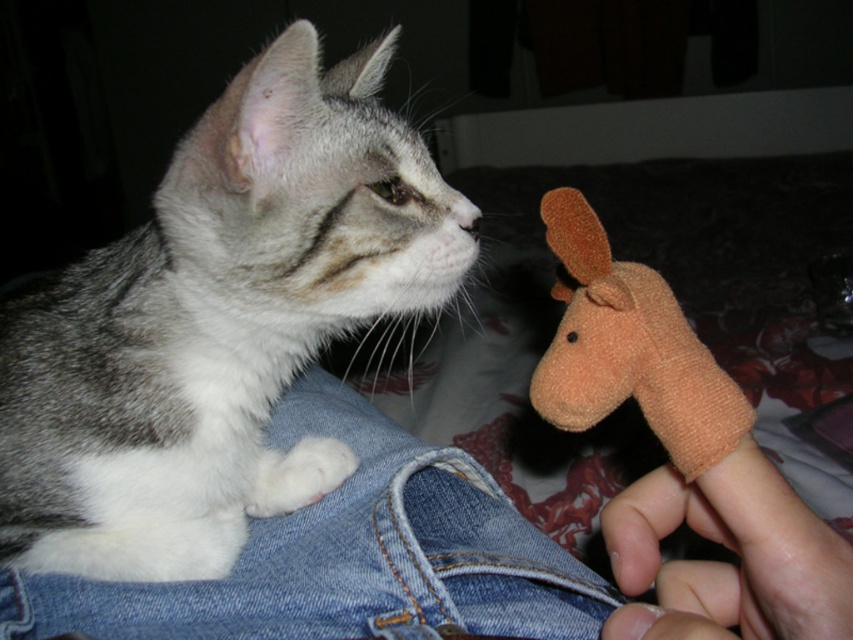
Who is more distant from viewer, [73,424] or [408,465]?

Point [408,465]

Where is `gray tabby cat at center`? gray tabby cat at center is located at coordinates (218, 323).

Based on the photo, does denim at left appear on the right side of orange fabric finger puppet at lower right?

Incorrect, denim at left is not on the right side of orange fabric finger puppet at lower right.

Does denim at left appear over orange fabric finger puppet at lower right?

Actually, denim at left is below orange fabric finger puppet at lower right.

Locate an element on the screen. Image resolution: width=853 pixels, height=640 pixels. denim at left is located at coordinates (349, 556).

Where is `denim at left`? The image size is (853, 640). denim at left is located at coordinates (349, 556).

Is gray tabby cat at center to the left of orange fabric finger puppet at lower right from the viewer's perspective?

Correct, you'll find gray tabby cat at center to the left of orange fabric finger puppet at lower right.

Is point (102, 566) farther from camera compared to point (660, 609)?

Yes, it is behind point (660, 609).

Is point (236, 120) in front of point (759, 461)?

No, it is not.

Locate an element on the screen. The width and height of the screenshot is (853, 640). gray tabby cat at center is located at coordinates pos(218,323).